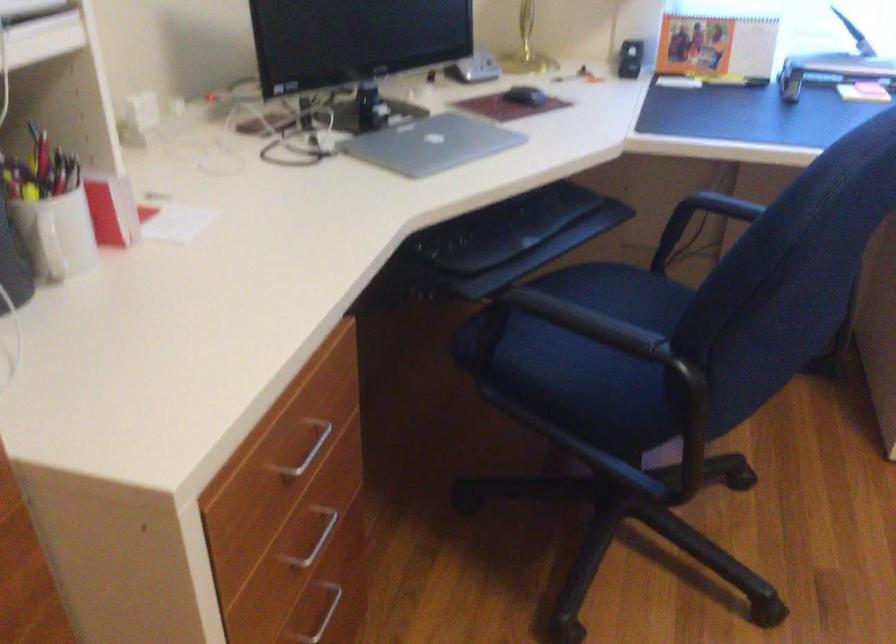
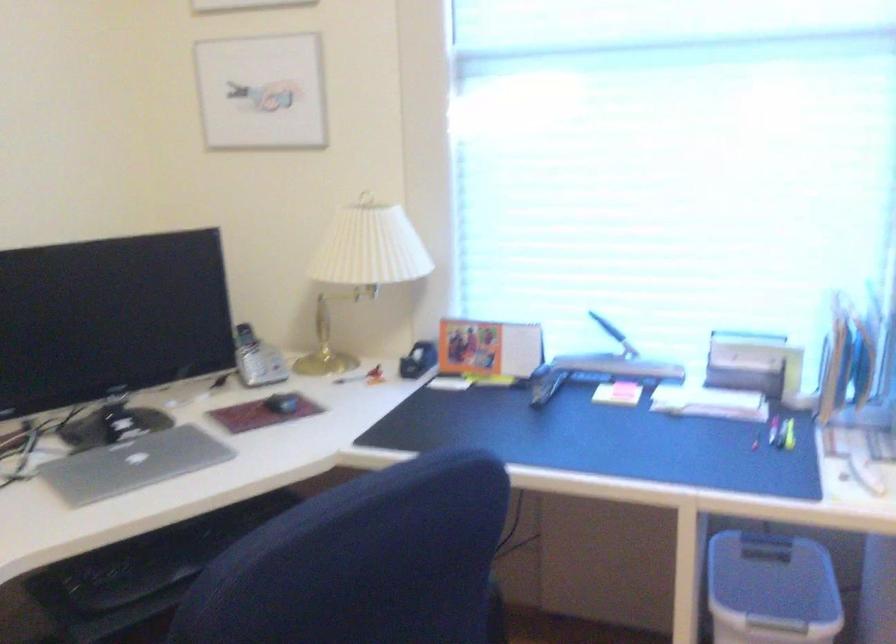
Find the pixel in the second image that matches point (532, 93) in the first image.

(281, 402)